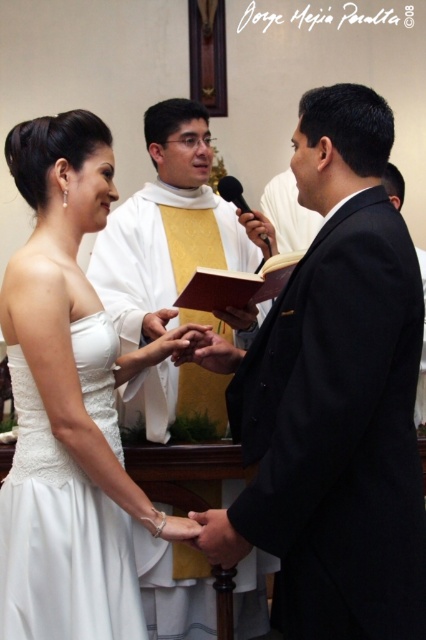
Question: Can you confirm if black matte suit at center is smaller than white satin dress at center?

Choices:
 (A) no
 (B) yes

Answer: (B)

Question: Which object is the closest to the silver metallic ring at lower center?

Choices:
 (A) matte black suit at center
 (B) black matte suit at center
 (C) white satin dress at center

Answer: (C)

Question: Is black matte suit at center bigger than white satin dress at center?

Choices:
 (A) yes
 (B) no

Answer: (B)

Question: Which point is closer to the camera?

Choices:
 (A) (83, 195)
 (B) (339, 317)
 (C) (158, 512)
 (D) (209, 243)

Answer: (B)

Question: In this image, where is matte black suit at center located relative to silver metallic ring at lower center?

Choices:
 (A) above
 (B) below

Answer: (A)

Question: Which point appears farthest from the camera in this image?

Choices:
 (A) (155, 520)
 (B) (20, 145)
 (C) (296, 477)
 (D) (196, 486)

Answer: (D)